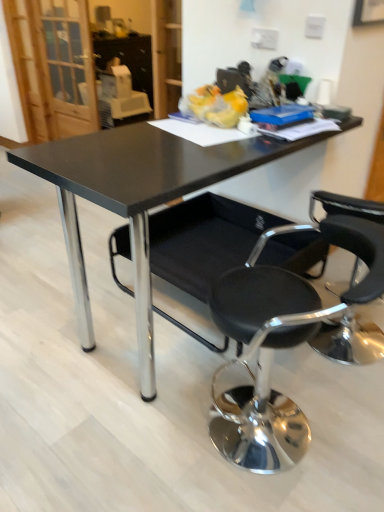
Question: Can you confirm if black glossy table at center is shorter than black fabric chair at center, the second chair viewed from the front?

Choices:
 (A) no
 (B) yes

Answer: (A)

Question: Is black glossy table at center to the left of black fabric chair at center, which is counted as the 1th chair, starting from the back, from the viewer's perspective?

Choices:
 (A) yes
 (B) no

Answer: (A)

Question: Is black glossy table at center positioned far away from black fabric chair at center, which is counted as the 1th chair, starting from the back?

Choices:
 (A) yes
 (B) no

Answer: (B)

Question: From the image's perspective, does black glossy table at center appear higher than black fabric chair at center, which is counted as the 1th chair, starting from the back?

Choices:
 (A) no
 (B) yes

Answer: (B)

Question: Is black glossy table at center further to the viewer compared to black fabric chair at center, which is counted as the 1th chair, starting from the back?

Choices:
 (A) no
 (B) yes

Answer: (A)

Question: Is black glossy table at center taller or shorter than black leather chair at lower right, which is the first chair from front to back?

Choices:
 (A) tall
 (B) short

Answer: (A)

Question: Based on their positions, is black glossy table at center located to the left or right of black leather chair at lower right, which is counted as the 2th chair, starting from the back?

Choices:
 (A) left
 (B) right

Answer: (A)

Question: Is point (251, 162) positioned closer to the camera than point (283, 430)?

Choices:
 (A) closer
 (B) farther

Answer: (A)

Question: From a real-world perspective, relative to black leather chair at lower right, which is counted as the 2th chair, starting from the back, is black glossy table at center vertically above or below?

Choices:
 (A) above
 (B) below

Answer: (A)

Question: Is black leather chair at lower right, which is counted as the 2th chair, starting from the back, inside the boundaries of black glossy table at center, or outside?

Choices:
 (A) inside
 (B) outside

Answer: (B)

Question: Is black leather chair at lower right, which is counted as the 2th chair, starting from the back, wider or thinner than black glossy table at center?

Choices:
 (A) thin
 (B) wide

Answer: (A)

Question: In the image, is black leather chair at lower right, which is the first chair from front to back, on the left side or the right side of black glossy table at center?

Choices:
 (A) left
 (B) right

Answer: (B)

Question: From a real-world perspective, is black leather chair at lower right, which is counted as the 2th chair, starting from the back, positioned above or below black glossy table at center?

Choices:
 (A) above
 (B) below

Answer: (B)

Question: In the image, is black leather chair at lower right, which is the first chair from front to back, positioned in front of or behind black fabric chair at center, which is counted as the 1th chair, starting from the back?

Choices:
 (A) behind
 (B) front

Answer: (B)

Question: Looking at the image, does black leather chair at lower right, which is the first chair from front to back, seem bigger or smaller compared to black fabric chair at center, the second chair viewed from the front?

Choices:
 (A) small
 (B) big

Answer: (A)